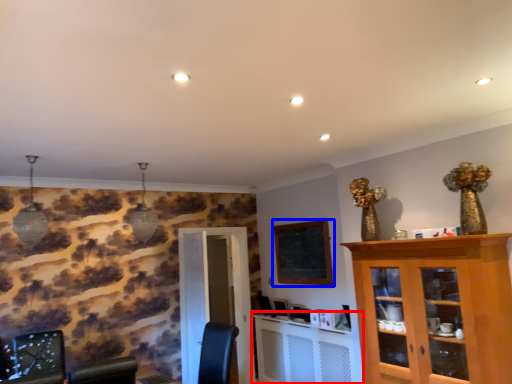
Question: Which point is further to the camera, computer desk (highlighted by a red box) or bulletin board (highlighted by a blue box)?

Choices:
 (A) computer desk
 (B) bulletin board

Answer: (B)